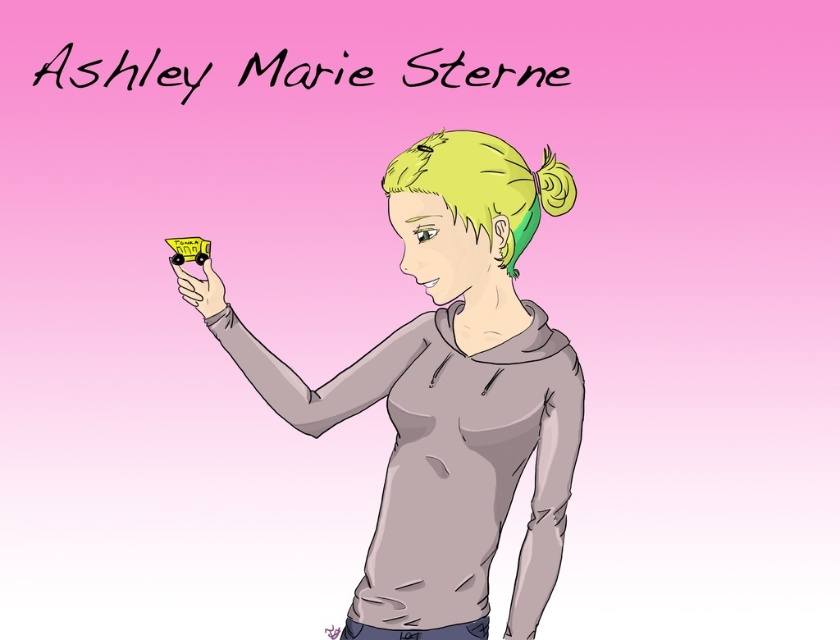
Question: Considering the relative positions of matte yellow toy truck at upper left and matte yellow toy car at center in the image provided, where is matte yellow toy truck at upper left located with respect to matte yellow toy car at center?

Choices:
 (A) below
 (B) above

Answer: (A)

Question: Which point is farther from the camera taking this photo?

Choices:
 (A) (181, 285)
 (B) (502, 154)

Answer: (A)

Question: Can you confirm if matte yellow toy truck at upper left is bigger than matte yellow toy car at center?

Choices:
 (A) yes
 (B) no

Answer: (A)

Question: Is matte yellow toy truck at upper left to the left of matte yellow toy car at center from the viewer's perspective?

Choices:
 (A) yes
 (B) no

Answer: (B)